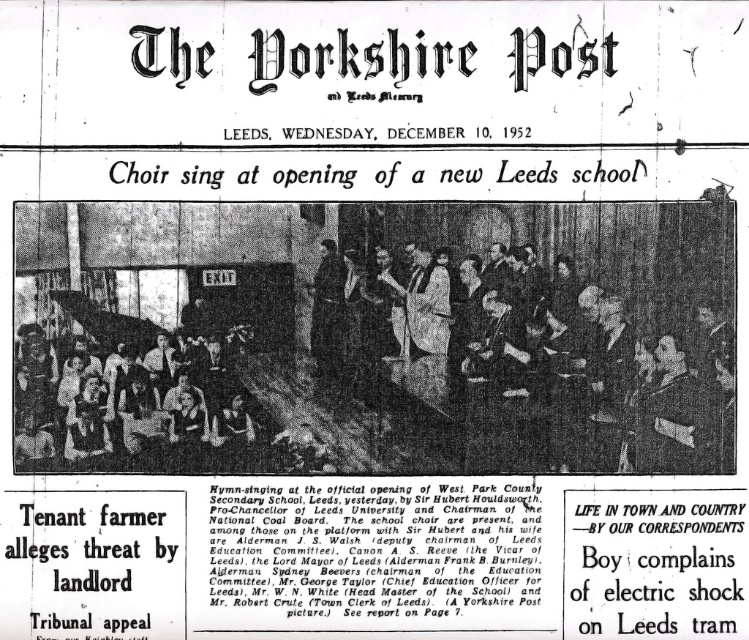
Image resolution: width=749 pixels, height=640 pixels. What do you see at coordinates (533, 358) in the screenshot?
I see `dark suit coat at center` at bounding box center [533, 358].

Does dark suit coat at center lie in front of matte black dress at lower left?

No, dark suit coat at center is further to the viewer.

At what (x,y) coordinates should I click in order to perform the action: click on dark suit coat at center. Please return your answer as a coordinate pair (x, y). The width and height of the screenshot is (749, 640). Looking at the image, I should click on (533, 358).